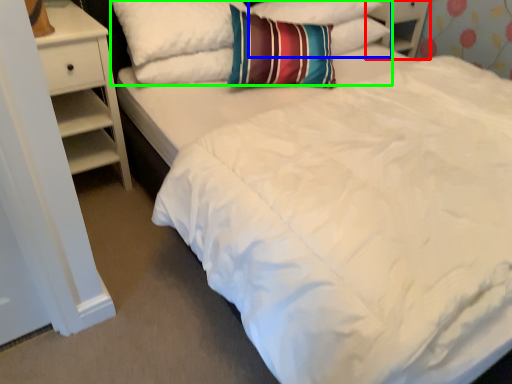
Question: Which is nearer to the dresser (highlighted by a red box)? pillow (highlighted by a blue box) or pillow (highlighted by a green box).

Choices:
 (A) pillow
 (B) pillow

Answer: (A)